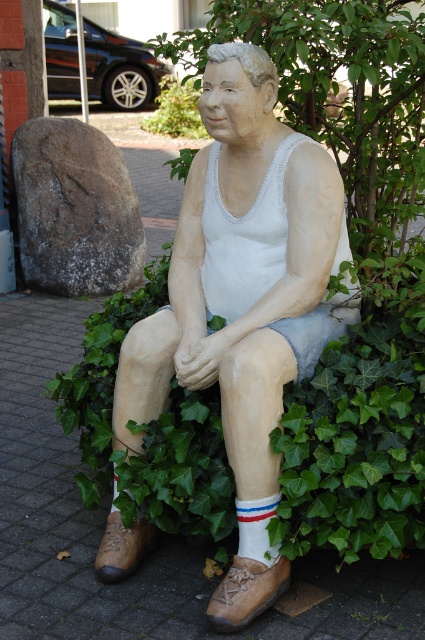
You are an artist planning to paint the scene. You need to know which object is larger to adjust your painting scale. Which one is bigger between the matte white statue at center and the green leafy plant at upper center?

The green leafy plant at upper center is larger than the matte white statue at center.

Consider the image. You are standing in front of the statue of the seated man. You want to place a small flower pot at the exact location of the point marked at coordinates point (277, 129). Can you estimate how far you need to walk from your current position to reach that point?

The point (277, 129) is 2.39 meters away from the viewer, so you need to walk approximately 2.39 meters to reach it.